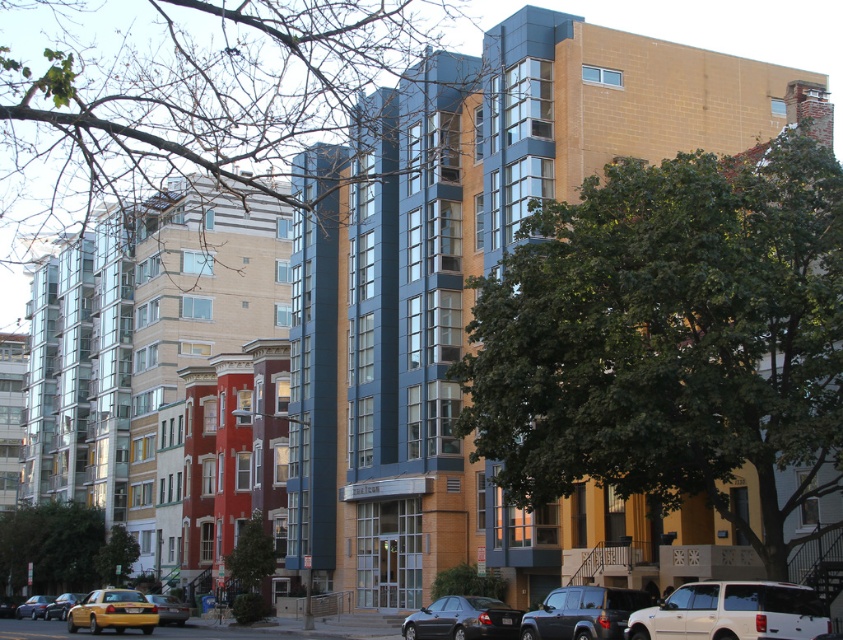
You are standing in the middle of the urban street scene and want to determine which of the two points, point (600, 609) or point (165, 602), is closer to you. Based on the scene description, which point is nearer?

Point (600, 609) is closer to the viewer than point (165, 602) according to the description.

You are a pedestrian standing on the sidewalk in this urban scene. You notice a yellow matte taxi at lower left and a metallic silver sedan at lower left. Which vehicle is positioned higher up relative to the other?

The yellow matte taxi at lower left is located above the metallic silver sedan at lower left, so it is positioned higher up.

You are a pedestrian standing at the center of the street looking towards the large blue building. You see the white matte suv at lower right and the yellow metallic taxi cab at lower left. Which vehicle is positioned higher relative to your viewpoint?

The white matte suv at lower right is located above the yellow metallic taxi cab at lower left, so the white matte suv at lower right is positioned higher relative to your viewpoint.